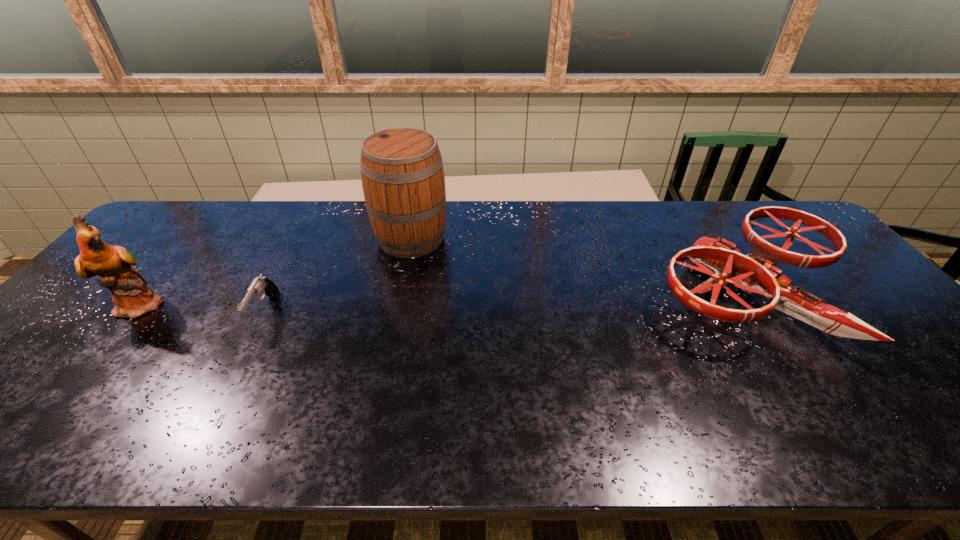
The width and height of the screenshot is (960, 540). Find the location of `object that stands as the third closest to the cider`. object that stands as the third closest to the cider is located at coordinates (754, 273).

You are a GUI agent. You are given a task and a screenshot of the screen. Output one action in this format:
    pyautogui.click(x=<x>, y=<y>)
    Task: Click on the free space in the image that satisfies the following two spatial constraints: 1. on the front side of the third tallest object; 2. on the front-facing side of the leftmost object
    This screenshot has height=540, width=960.
    Given the screenshot: What is the action you would take?
    click(x=752, y=305)

Locate an element on the screen. This screenshot has width=960, height=540. vacant space that satisfies the following two spatial constraints: 1. on the front side of the second shortest object; 2. on the front-facing side of the leftmost object is located at coordinates [x=752, y=305].

Identify the location of free point that satisfies the following two spatial constraints: 1. on the front side of the cider; 2. on the front-facing side of the leftmost object. (397, 305).